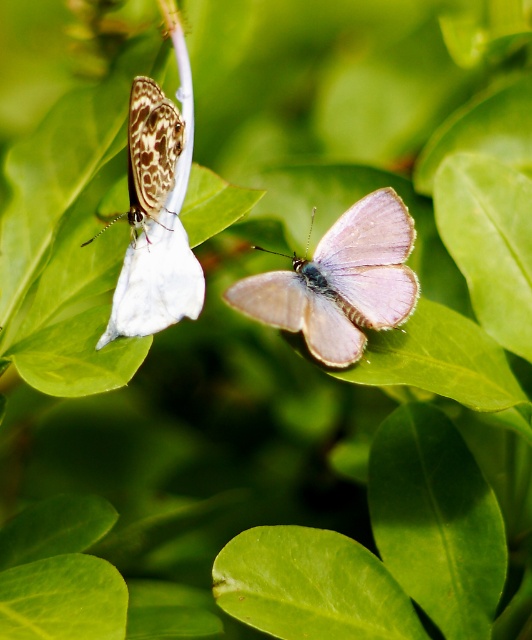
You are an entomologist observing two butterflies in a garden. You notice the pale purple iridescent wing at center and the speckled brown butterfly at upper left. Which butterfly is located higher up in the image?

The speckled brown butterfly at upper left is located higher up in the image because the pale purple iridescent wing at center is positioned under it.

You are a gardener observing the green smooth leaf at lower left and the speckled brown butterfly at upper left. Which object is shorter in height?

The green smooth leaf at lower left has a lesser height compared to the speckled brown butterfly at upper left, so the green smooth leaf at lower left is shorter in height.